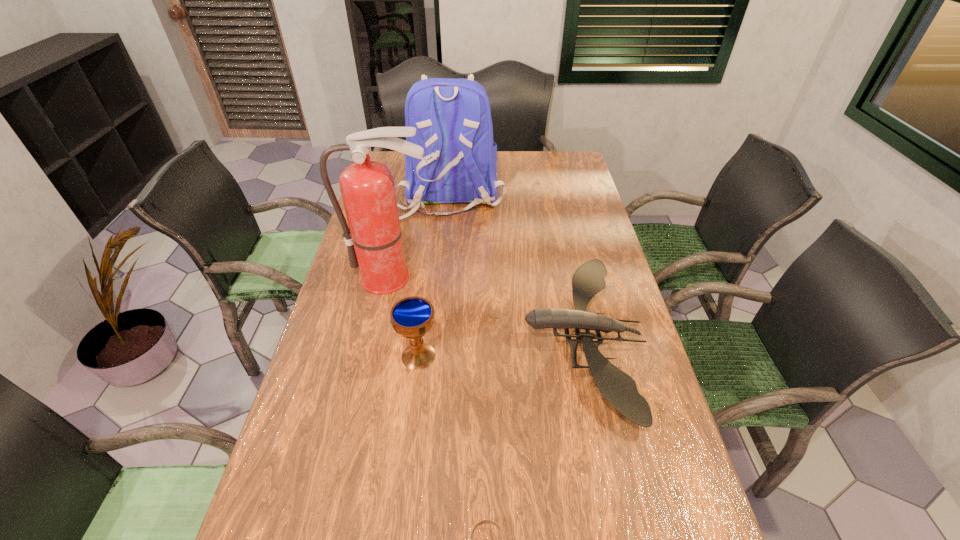
Where is `blank space located 0.330m at the head of the second shortest object`? blank space located 0.330m at the head of the second shortest object is located at coordinates (402, 339).

You are a GUI agent. You are given a task and a screenshot of the screen. Output one action in this format:
    pyautogui.click(x=<x>, y=<y>)
    Task: Click on the object that is at the far edge
    
    Given the screenshot: What is the action you would take?
    pyautogui.click(x=452, y=117)

Locate an element on the screen. The width and height of the screenshot is (960, 540). fire extinguisher located at the left edge is located at coordinates (374, 240).

Locate an element on the screen. backpack that is at the left edge is located at coordinates (452, 117).

The width and height of the screenshot is (960, 540). I want to click on object located at the right edge, so click(x=618, y=388).

Identify the location of object that is at the far left corner. Image resolution: width=960 pixels, height=540 pixels. (452, 117).

Locate an element on the screen. vacant space at the far edge of the desktop is located at coordinates (505, 165).

I want to click on free location at the left edge, so click(x=348, y=255).

In the image, there is a desktop. Identify the location of vacant space at the right edge. (560, 222).

Image resolution: width=960 pixels, height=540 pixels. In the image, there is a desktop. In order to click on free space at the far right corner in this screenshot , I will do `click(562, 170)`.